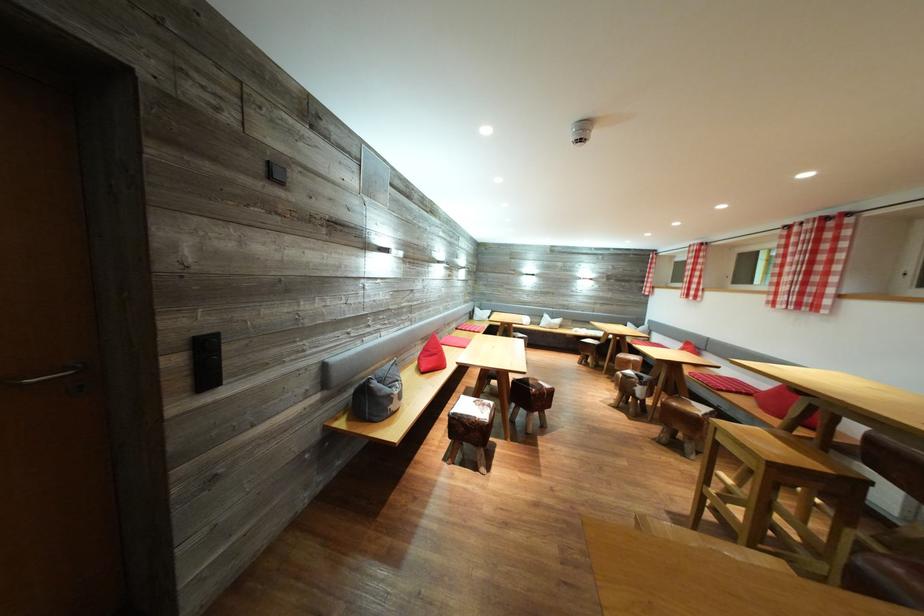
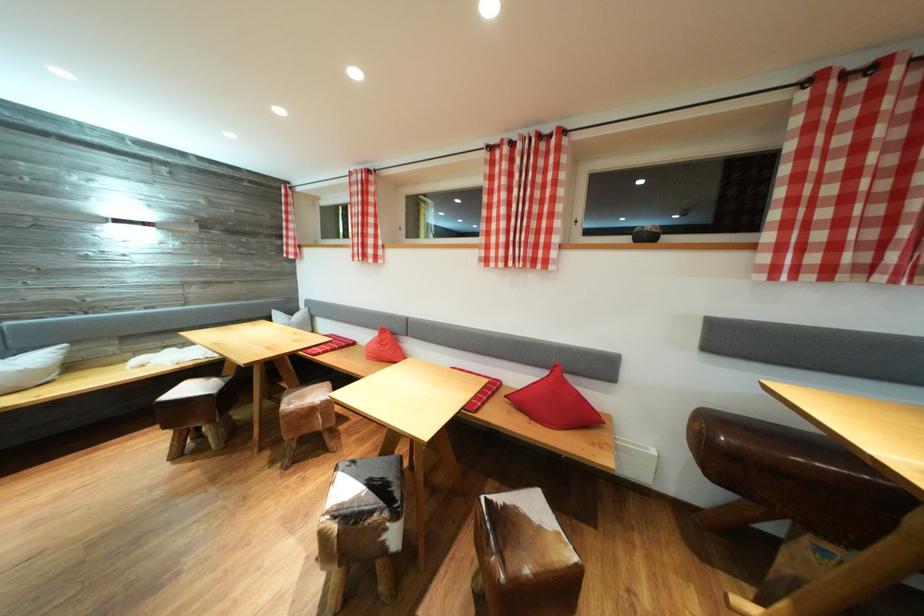
The point at (x=560, y=323) is marked in the first image. Where is the corresponding point in the second image?

(14, 358)